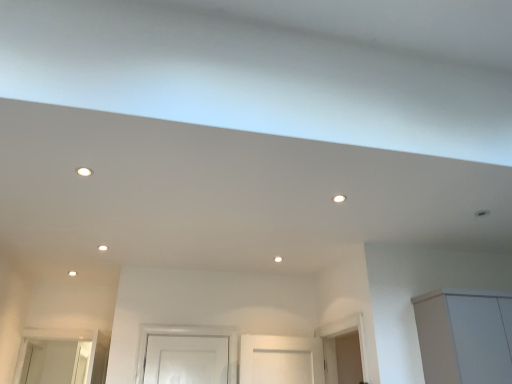
Question: Is white matte cabinet at lower right in contact with white glossy light fixture at upper left, the 2th lighting in the back-to-front sequence?

Choices:
 (A) yes
 (B) no

Answer: (B)

Question: Is white glossy light fixture at upper left, arranged as the first lighting when viewed from the left, completely or partially inside white matte cabinet at lower right?

Choices:
 (A) no
 (B) yes

Answer: (A)

Question: From a real-world perspective, is white matte cabinet at lower right over white glossy light fixture at upper left, the second lighting in the bottom-to-top sequence?

Choices:
 (A) yes
 (B) no

Answer: (B)

Question: Is white matte cabinet at lower right not within white glossy light fixture at upper left, placed as the 2th lighting when sorted from right to left?

Choices:
 (A) no
 (B) yes

Answer: (B)

Question: Is white matte cabinet at lower right at the left side of white glossy light fixture at upper left, the second lighting in the bottom-to-top sequence?

Choices:
 (A) yes
 (B) no

Answer: (B)

Question: Is point (78, 173) closer or farther from the camera than point (339, 201)?

Choices:
 (A) farther
 (B) closer

Answer: (B)

Question: Based on their positions, is white glossy light fixture at upper left, placed as the 2th lighting when sorted from right to left, located to the left or right of matte white light fixture at center, which ranks as the 1th lighting in back-to-front order?

Choices:
 (A) right
 (B) left

Answer: (B)

Question: From their relative heights in the image, would you say white glossy light fixture at upper left, marked as the first lighting in a top-to-bottom arrangement, is taller or shorter than matte white light fixture at center, the second lighting viewed from the top?

Choices:
 (A) short
 (B) tall

Answer: (A)

Question: Is white glossy light fixture at upper left, which appears as the 1th lighting when viewed from the front, in front of or behind matte white light fixture at center, which is the 2th lighting in front-to-back order, in the image?

Choices:
 (A) front
 (B) behind

Answer: (A)

Question: Considering the positions of white glossy light fixture at upper left, marked as the first lighting in a top-to-bottom arrangement, and white matte cabinet at lower right in the image, is white glossy light fixture at upper left, marked as the first lighting in a top-to-bottom arrangement, wider or thinner than white matte cabinet at lower right?

Choices:
 (A) thin
 (B) wide

Answer: (A)

Question: Which is correct: white glossy light fixture at upper left, which appears as the 1th lighting when viewed from the front, is inside white matte cabinet at lower right, or outside of it?

Choices:
 (A) inside
 (B) outside

Answer: (B)

Question: From a real-world perspective, relative to white matte cabinet at lower right, is white glossy light fixture at upper left, arranged as the first lighting when viewed from the left, vertically above or below?

Choices:
 (A) below
 (B) above

Answer: (B)

Question: Considering the relative positions of white glossy light fixture at upper left, marked as the first lighting in a top-to-bottom arrangement, and white matte cabinet at lower right in the image provided, is white glossy light fixture at upper left, marked as the first lighting in a top-to-bottom arrangement, to the left or to the right of white matte cabinet at lower right?

Choices:
 (A) right
 (B) left

Answer: (B)

Question: Is point (439, 296) closer or farther from the camera than point (339, 196)?

Choices:
 (A) farther
 (B) closer

Answer: (A)

Question: In the image, is white matte cabinet at lower right positioned in front of or behind matte white light fixture at center, placed as the 2th lighting when sorted from left to right?

Choices:
 (A) behind
 (B) front

Answer: (A)